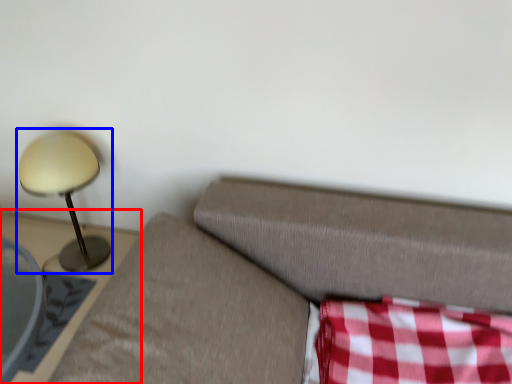
Question: Which object appears farthest to the camera in this image, furniture (highlighted by a red box) or lamp (highlighted by a blue box)?

Choices:
 (A) furniture
 (B) lamp

Answer: (B)